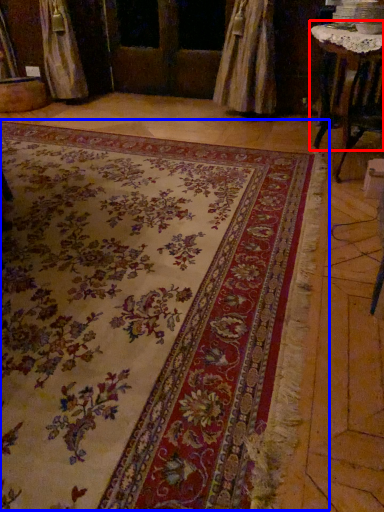
Question: Which object appears closest to the camera in this image, table (highlighted by a red box) or mat (highlighted by a blue box)?

Choices:
 (A) table
 (B) mat

Answer: (B)